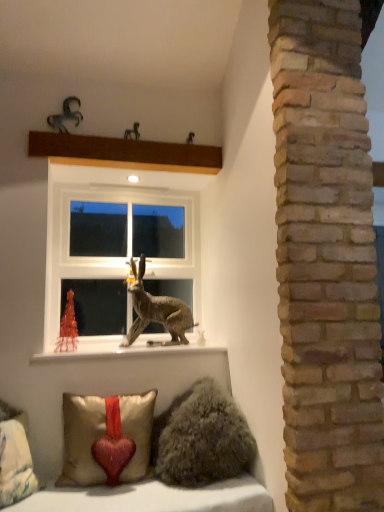
The image size is (384, 512). I want to click on vacant space underneath satin gold pillow with red heart at lower left, the first pillow positioned from the right (from a real-world perspective), so click(99, 487).